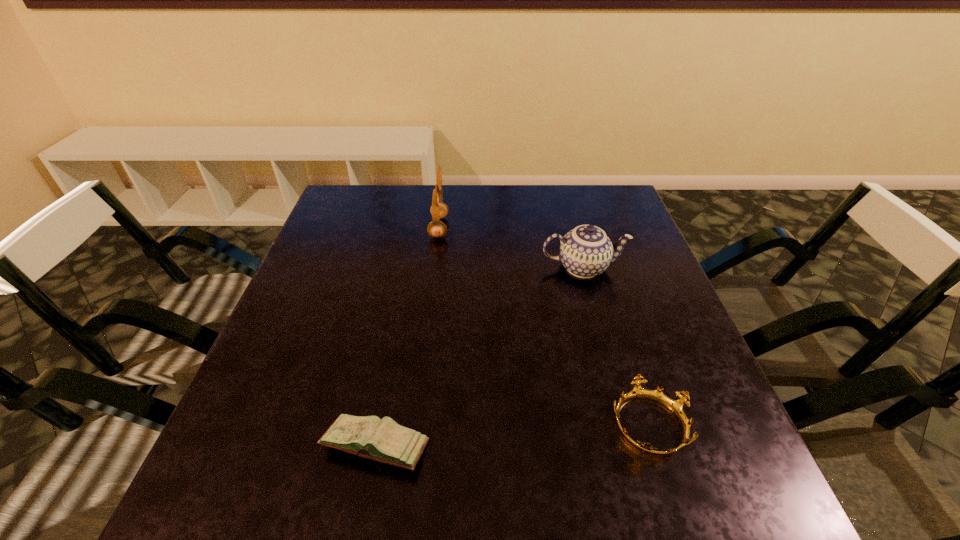
The image size is (960, 540). What are the coordinates of `empty location between the earphone and the crown` in the screenshot? It's located at (543, 326).

Image resolution: width=960 pixels, height=540 pixels. What are the coordinates of `free space between the crown and the diary` in the screenshot? It's located at (512, 435).

Identify the location of blank region between the farthest object and the diary. Image resolution: width=960 pixels, height=540 pixels. (407, 337).

Identify the location of free space between the diary and the tallest object. The image size is (960, 540). (407, 337).

Locate an element on the screen. The height and width of the screenshot is (540, 960). vacant space in between the diary and the crown is located at coordinates (512, 435).

This screenshot has width=960, height=540. I want to click on free area in between the crown and the diary, so click(512, 435).

The width and height of the screenshot is (960, 540). What are the coordinates of `vacant point located between the diary and the third shortest object` in the screenshot? It's located at (479, 357).

Find the location of a particular element. This screenshot has width=960, height=540. free space between the tallest object and the second farthest object is located at coordinates (511, 247).

Where is `vacant space that's between the farthest object and the diary`? vacant space that's between the farthest object and the diary is located at coordinates (407, 337).

Identify which object is the second closest to the second farthest object. Please provide its 2D coordinates. Your answer should be formatted as a tuple, i.e. [(x, y)], where the tuple contains the x and y coordinates of a point satisfying the conditions above.

[(676, 407)]